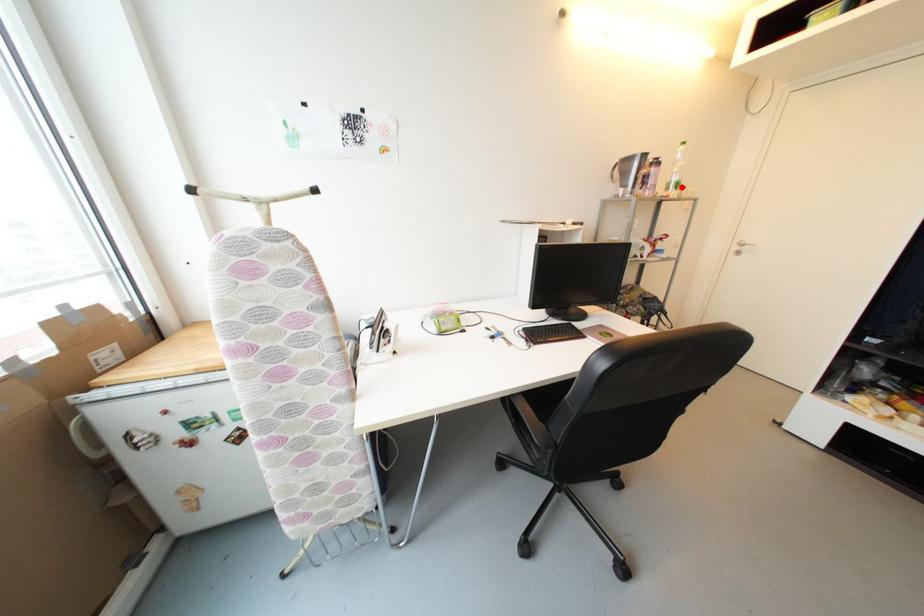
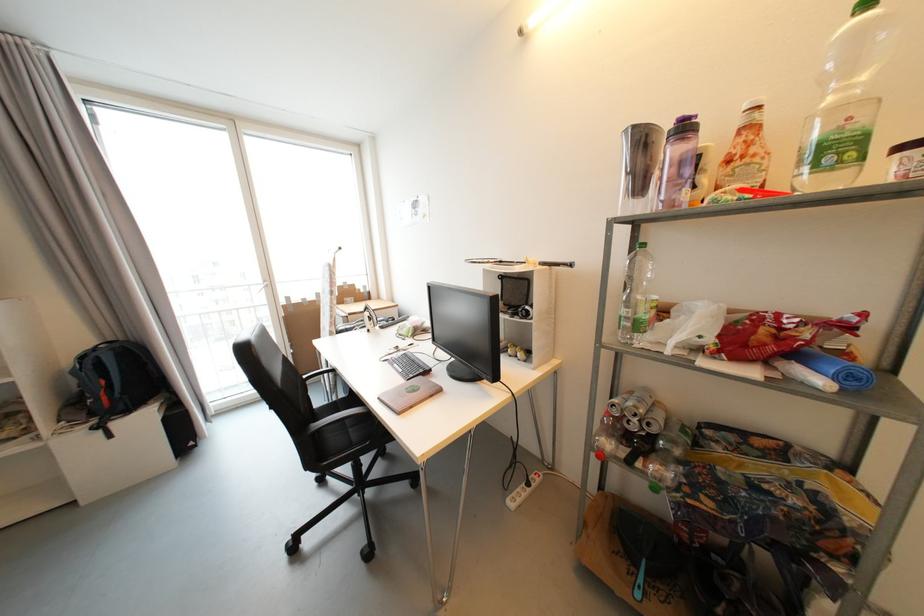
The point at the highlighted location is marked in the first image. Where is the corresponding point in the second image?

(842, 151)